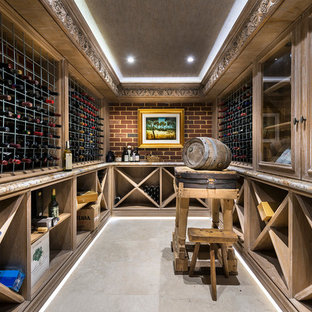
The height and width of the screenshot is (312, 312). What are the coordinates of `glass window` in the screenshot? It's located at (275, 115).